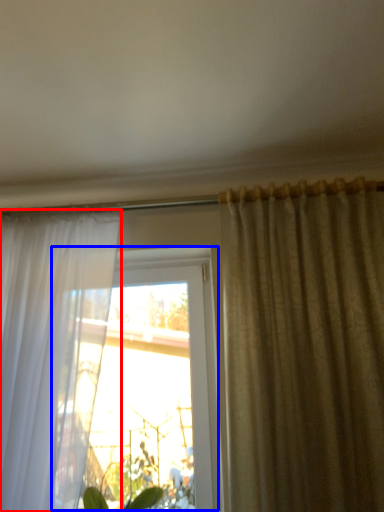
Question: Which object appears farthest to the camera in this image, curtain (highlighted by a red box) or window (highlighted by a blue box)?

Choices:
 (A) curtain
 (B) window

Answer: (B)